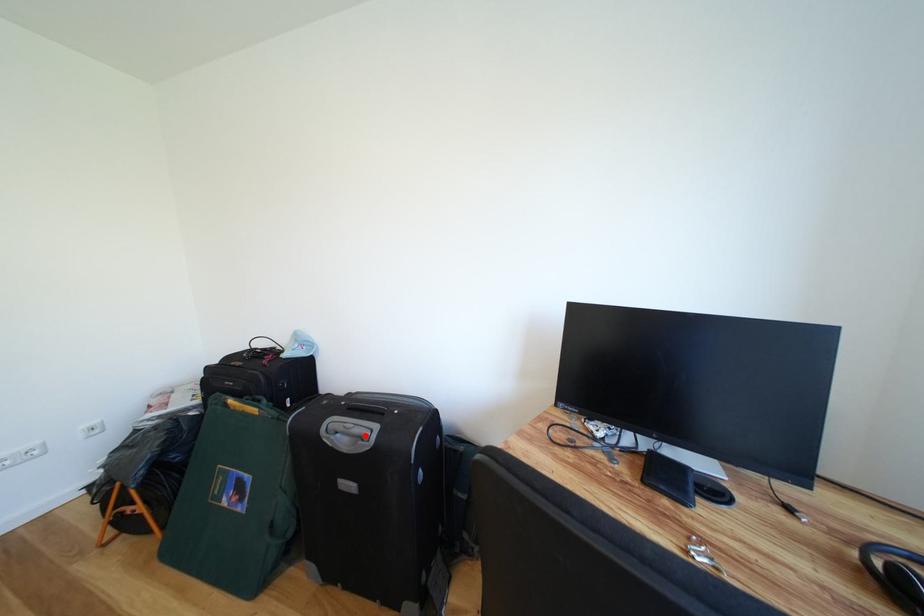
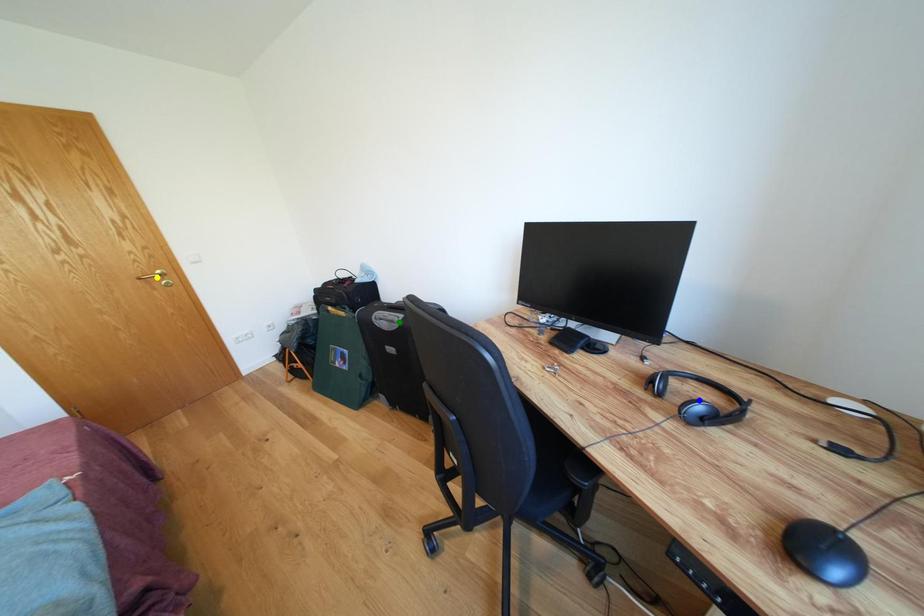
Question: I am providing you with two images of the same scene from different viewpoints. A red point is marked on the first image. You are given multiple points on the second image. In image 2, which mark is for the same physical point as the one in image 1?

Choices:
 (A) yellow point
 (B) blue point
 (C) green point

Answer: (C)